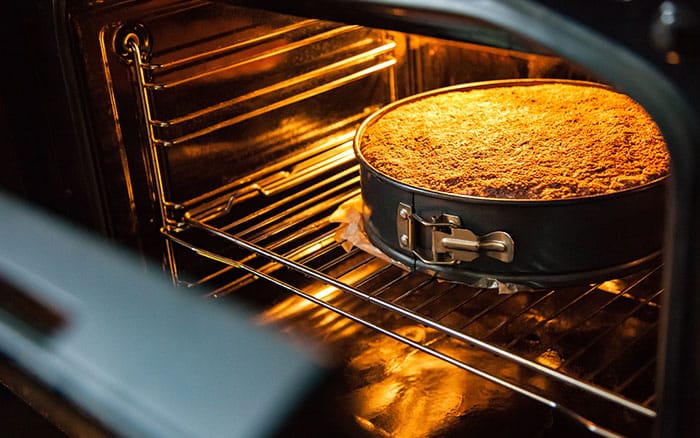
I want to click on rubber seal of oven, so click(614, 62).